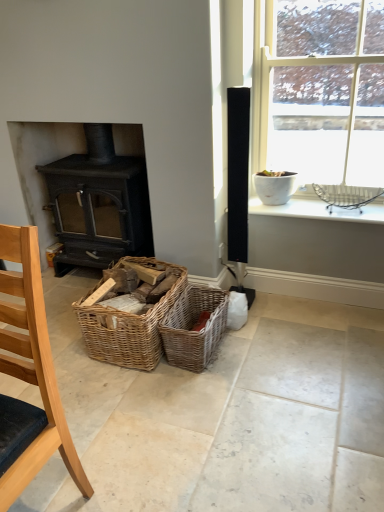
Question: Which direction should I rotate to look at woven brown picnic basket at center, positioned as the second picnic basket in left-to-right order?

Choices:
 (A) right
 (B) left

Answer: (A)

Question: Would you say metallic wire basket at upper right is a long distance from white glossy pot at upper right?

Choices:
 (A) no
 (B) yes

Answer: (A)

Question: Is the surface of metallic wire basket at upper right in direct contact with white glossy pot at upper right?

Choices:
 (A) no
 (B) yes

Answer: (A)

Question: Does metallic wire basket at upper right have a greater height compared to white glossy pot at upper right?

Choices:
 (A) yes
 (B) no

Answer: (B)

Question: From a real-world perspective, is metallic wire basket at upper right located higher than white glossy pot at upper right?

Choices:
 (A) no
 (B) yes

Answer: (A)

Question: Can you confirm if metallic wire basket at upper right is shorter than white glossy pot at upper right?

Choices:
 (A) yes
 (B) no

Answer: (A)

Question: From the image's perspective, is metallic wire basket at upper right below white glossy pot at upper right?

Choices:
 (A) yes
 (B) no

Answer: (A)

Question: From a real-world perspective, is matte black wood burning stove at left on top of woven wood baskets at center, which ranks as the 1th picnic basket in left-to-right order?

Choices:
 (A) yes
 (B) no

Answer: (A)

Question: Are matte black wood burning stove at left and woven wood baskets at center, which ranks as the 1th picnic basket in left-to-right order, beside each other?

Choices:
 (A) yes
 (B) no

Answer: (B)

Question: Is matte black wood burning stove at left further to camera compared to woven wood baskets at center, which ranks as the 1th picnic basket in left-to-right order?

Choices:
 (A) yes
 (B) no

Answer: (A)

Question: Is matte black wood burning stove at left to the left of woven wood baskets at center, which ranks as the 1th picnic basket in left-to-right order, from the viewer's perspective?

Choices:
 (A) yes
 (B) no

Answer: (A)

Question: Does matte black wood burning stove at left have a greater width compared to woven wood baskets at center, marked as the 2th picnic basket in a right-to-left arrangement?

Choices:
 (A) no
 (B) yes

Answer: (A)

Question: From the image's perspective, would you say matte black wood burning stove at left is shown under woven wood baskets at center, which ranks as the 1th picnic basket in left-to-right order?

Choices:
 (A) yes
 (B) no

Answer: (B)

Question: Would you say woven wood baskets at center, which ranks as the 1th picnic basket in left-to-right order, contains woven brown picnic basket at center, positioned as the second picnic basket in left-to-right order?

Choices:
 (A) yes
 (B) no

Answer: (B)